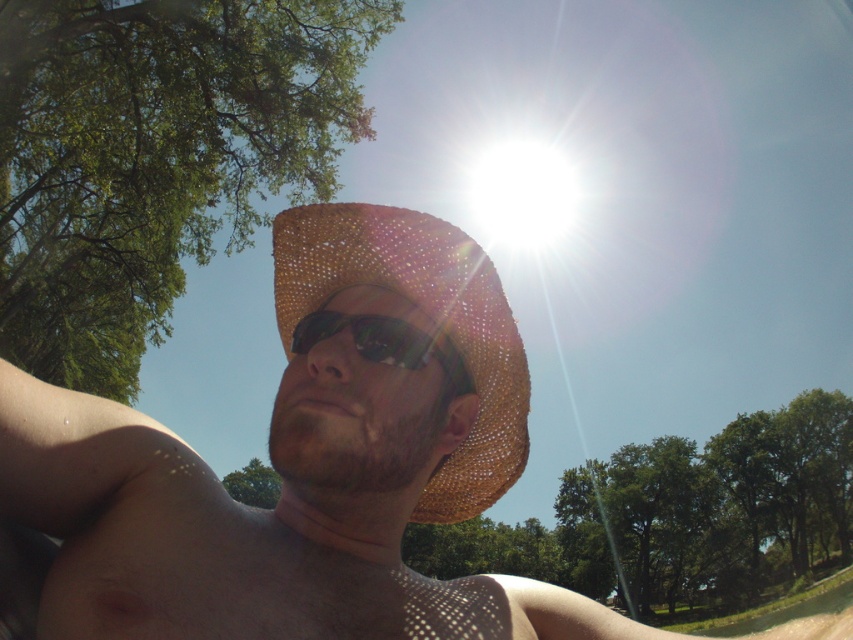
Question: Which object is farther from the camera taking this photo?

Choices:
 (A) braided straw cowboy hat at center
 (B) sunglasses at center
 (C) brown straw hat at center

Answer: (A)

Question: Which point is farther from the camera taking this photo?

Choices:
 (A) (608, 634)
 (B) (396, 340)

Answer: (A)

Question: Observing the image, what is the correct spatial positioning of brown straw hat at center in reference to sunglasses at center?

Choices:
 (A) left
 (B) right

Answer: (B)

Question: Is braided straw cowboy hat at center below sunglasses at center?

Choices:
 (A) yes
 (B) no

Answer: (A)

Question: Among these objects, which one is nearest to the camera?

Choices:
 (A) sunglasses at center
 (B) braided straw cowboy hat at center
 (C) brown straw hat at center

Answer: (C)

Question: Considering the relative positions of brown straw hat at center and sunglasses at center in the image provided, where is brown straw hat at center located with respect to sunglasses at center?

Choices:
 (A) below
 (B) above

Answer: (A)